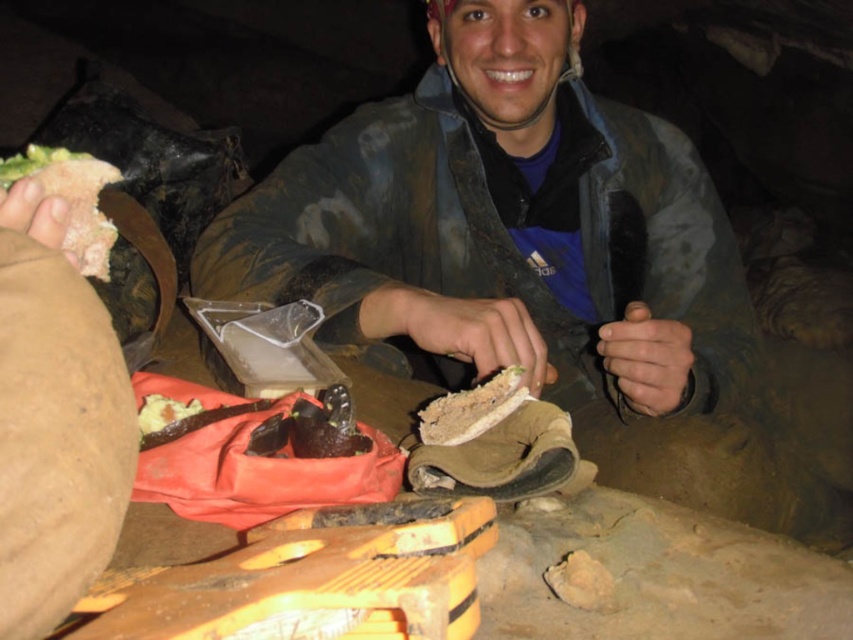
Question: Is brown crumbly bread at left bigger than sandy brown bread at center?

Choices:
 (A) yes
 (B) no

Answer: (A)

Question: Which object is positioned farthest from the sandy brown bread at center?

Choices:
 (A) brown crumbly bread at center
 (B) brown crumbly bread at left

Answer: (B)

Question: Among these objects, which one is farthest from the camera?

Choices:
 (A) brown crumbly bread at left
 (B) brown crumbly bread at center
 (C) sandy brown bread at center

Answer: (C)

Question: Is brown crumbly bread at left in front of brown crumbly bread at center?

Choices:
 (A) no
 (B) yes

Answer: (B)

Question: Does sandy brown bread at center have a smaller size compared to brown crumbly bread at center?

Choices:
 (A) no
 (B) yes

Answer: (A)

Question: Which object is farther from the camera taking this photo?

Choices:
 (A) brown crumbly bread at center
 (B) brown crumbly bread at left

Answer: (A)